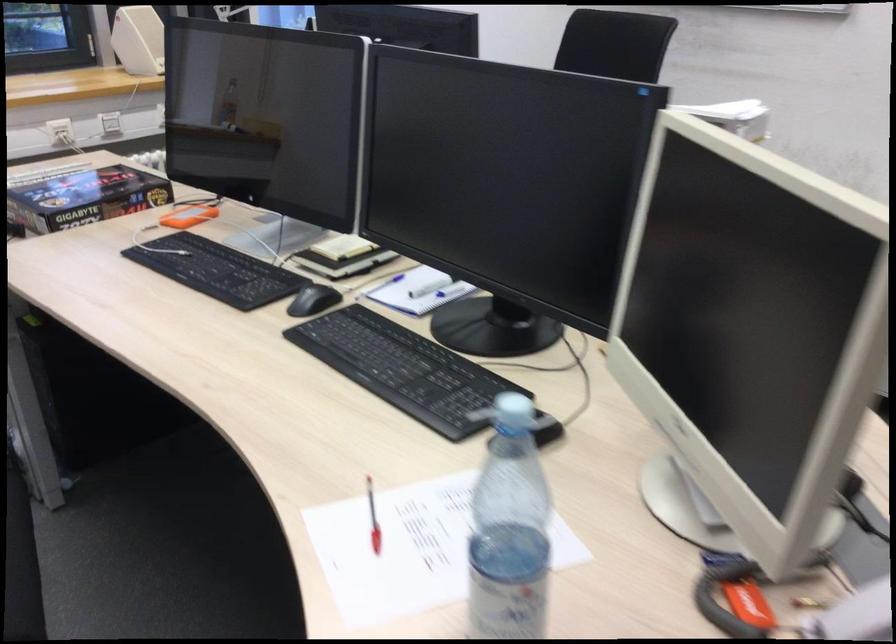
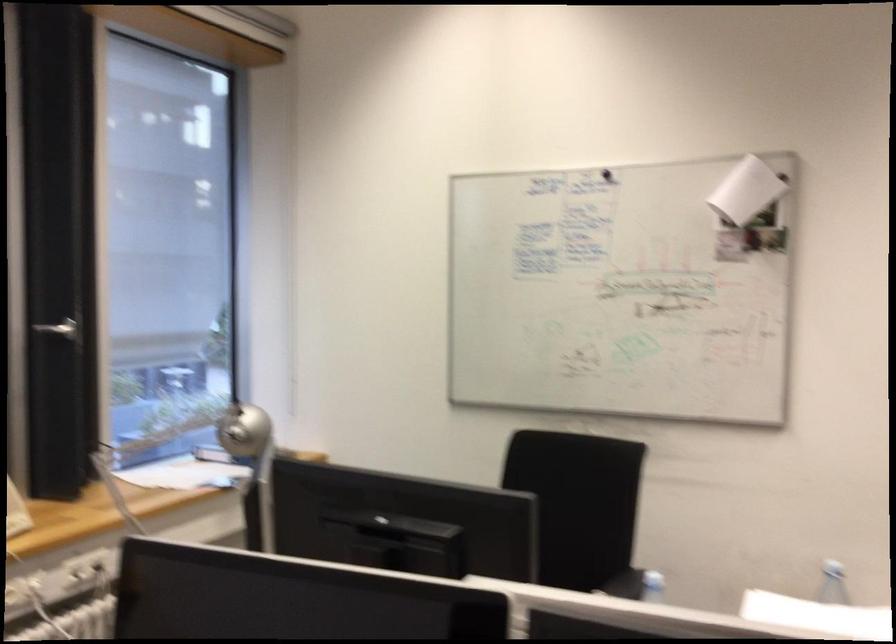
Consider the image. The images are taken continuously from a first-person perspective. In which direction are you moving?

The cameraman moved toward left, forward.